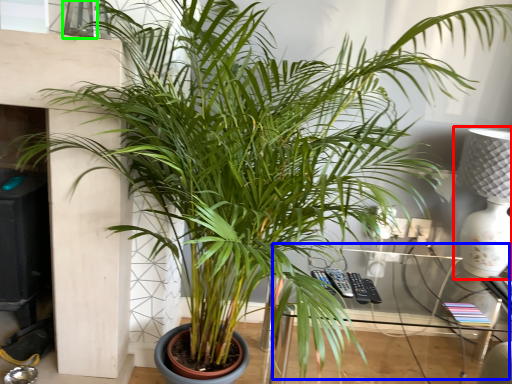
Question: Based on their relative distances, which object is farther from table lamp (highlighted by a red box)? Choose from table (highlighted by a blue box) and window (highlighted by a green box).

Choices:
 (A) table
 (B) window

Answer: (B)